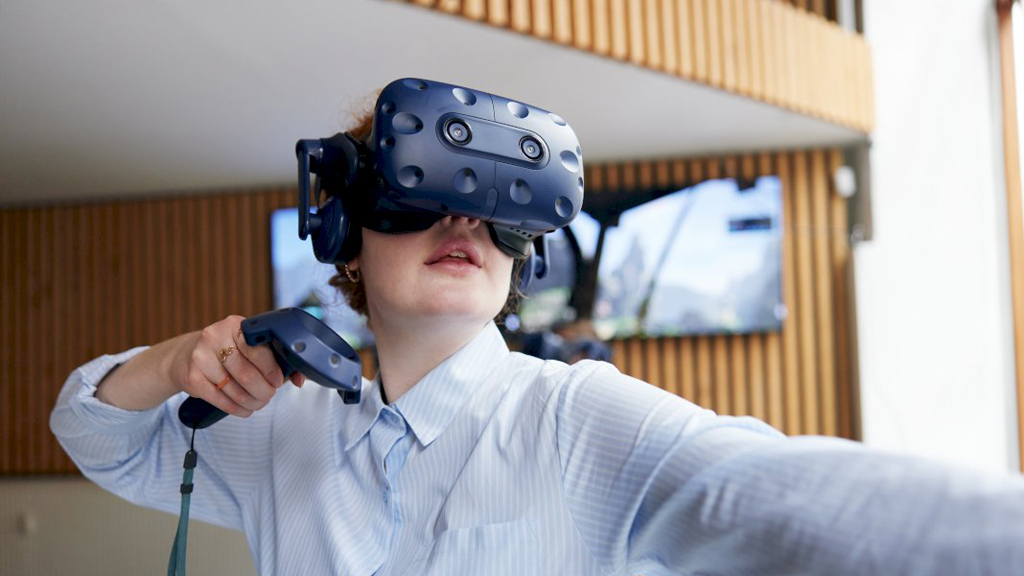
In order to click on tv screen in this screenshot , I will do `click(711, 269)`.